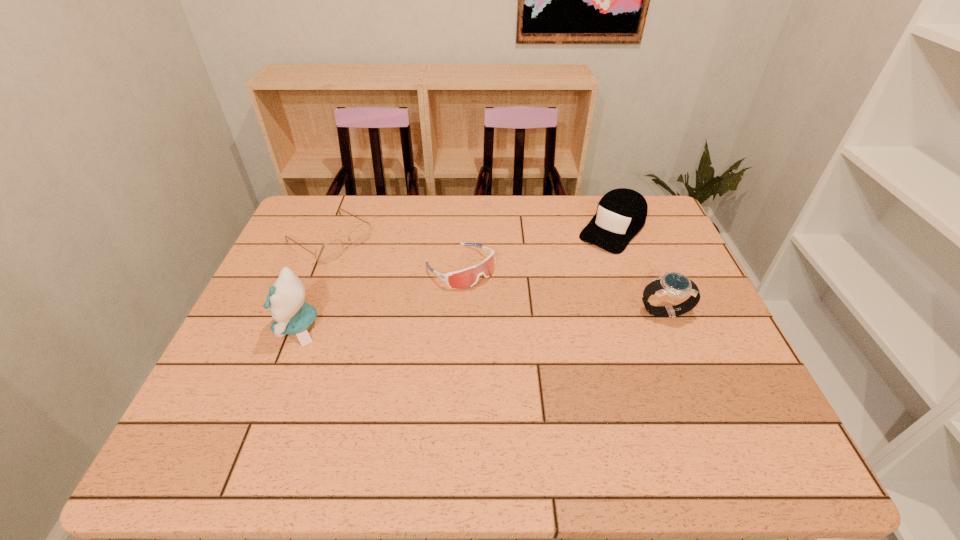
At what (x,y) coordinates should I click in order to perform the action: click on watch located at the right edge. Please return your answer as a coordinate pair (x, y). Looking at the image, I should click on (676, 285).

Locate an element on the screen. This screenshot has width=960, height=540. cap at the right edge is located at coordinates (621, 213).

Image resolution: width=960 pixels, height=540 pixels. Find the location of `object that is positioned at the far left corner`. object that is positioned at the far left corner is located at coordinates (327, 252).

The width and height of the screenshot is (960, 540). I want to click on object that is at the far right corner, so click(x=621, y=213).

At what (x,y) coordinates should I click in order to perform the action: click on vacant space at the far edge of the desktop. Please return your answer as a coordinate pair (x, y). The height and width of the screenshot is (540, 960). Looking at the image, I should click on (392, 210).

The height and width of the screenshot is (540, 960). I want to click on vacant space at the near edge of the desktop, so click(x=573, y=399).

Where is `blank space at the left edge of the desktop`? The image size is (960, 540). blank space at the left edge of the desktop is located at coordinates (264, 343).

Where is `free space at the right edge`? free space at the right edge is located at coordinates (652, 315).

Locate an element on the screen. This screenshot has width=960, height=540. vacant space at the far left corner of the desktop is located at coordinates (316, 214).

Where is `vacant area at the near right corner of the desktop`? This screenshot has width=960, height=540. vacant area at the near right corner of the desktop is located at coordinates (747, 393).